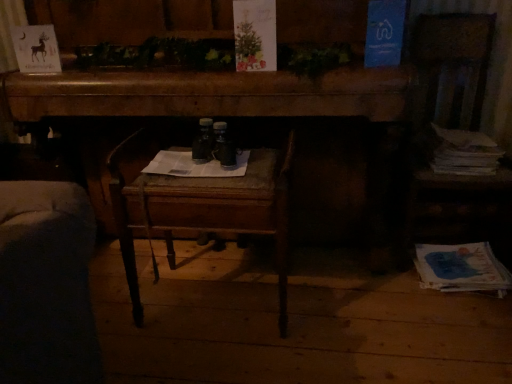
Identify the location of free space in front of blue paper at lower right, the 2th magazine from the top. (466, 326).